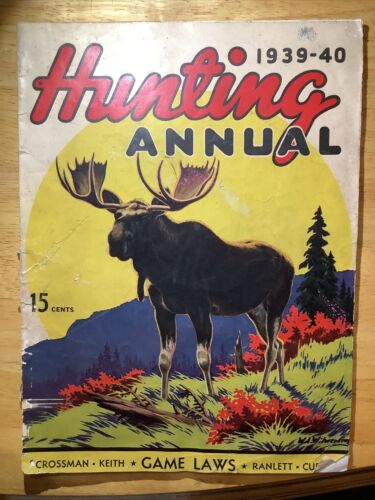
You are a GUI agent. You are given a task and a screenshot of the screen. Output one action in this format:
    pyautogui.click(x=<x>, y=<y>)
    Task: Click on the magazine
    This screenshot has width=375, height=500.
    Given the screenshot: What is the action you would take?
    pyautogui.click(x=156, y=43)